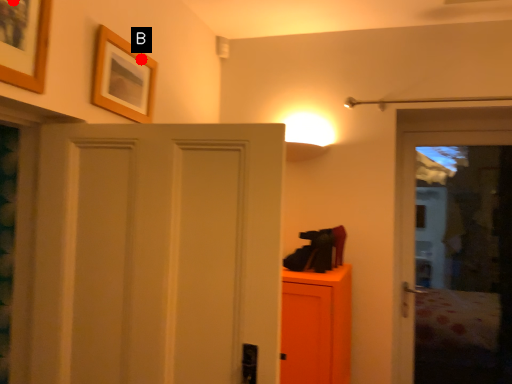
Question: Two points are circled on the image, labeled by A and B beside each circle. Which point is farther from the camera taking this photo?

Choices:
 (A) A is further
 (B) B is further

Answer: (B)